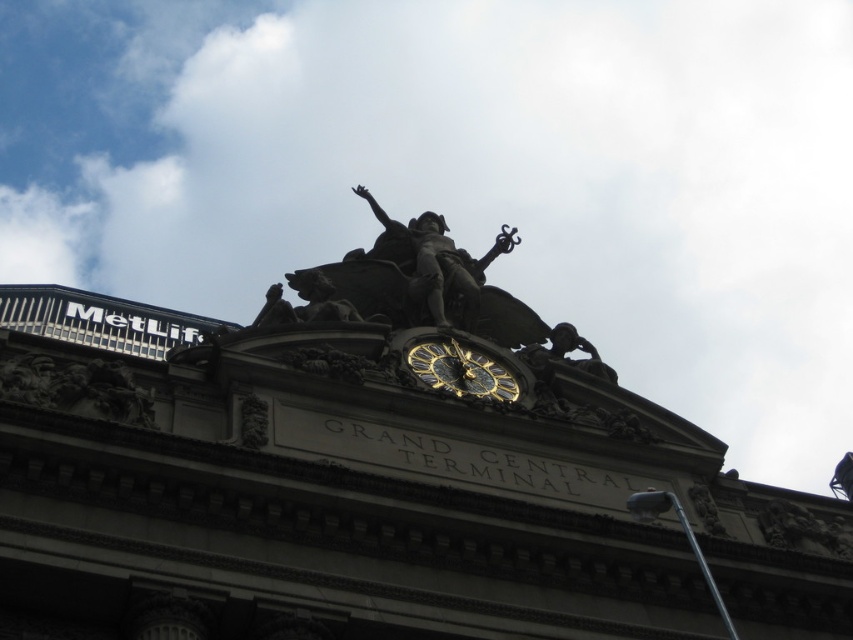
Question: Is bronze statue at center thinner than gold polished clock at center?

Choices:
 (A) no
 (B) yes

Answer: (A)

Question: Among these points, which one is nearest to the camera?

Choices:
 (A) (440, 257)
 (B) (436, 355)

Answer: (B)

Question: Does bronze statue at center appear over gold polished clock at center?

Choices:
 (A) no
 (B) yes

Answer: (B)

Question: From the image, what is the correct spatial relationship of bronze statue at center in relation to gold polished clock at center?

Choices:
 (A) left
 (B) right

Answer: (A)

Question: Which point is farther to the camera?

Choices:
 (A) (416, 349)
 (B) (462, 252)

Answer: (B)